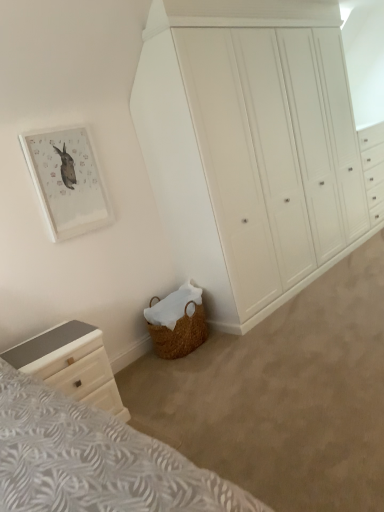
Question: From the image's perspective, is white glossy chest of drawers at lower left, the 2th chest of drawers from the right, positioned above or below matte white picture frame at upper left?

Choices:
 (A) above
 (B) below

Answer: (B)

Question: Considering their positions, is white glossy chest of drawers at lower left, arranged as the 2th chest of drawers when viewed from the back, located in front of or behind matte white picture frame at upper left?

Choices:
 (A) front
 (B) behind

Answer: (A)

Question: Which is farther from the matte white picture frame at upper left?

Choices:
 (A) white painted wood wardrobe at center, which ranks as the 2th chest of drawers in bottom-to-top order
 (B) white glossy chest of drawers at lower left, arranged as the 2th chest of drawers when viewed from the back

Answer: (A)

Question: Which object is positioned closest to the white painted wood wardrobe at center, which appears as the 1th chest of drawers when viewed from the back?

Choices:
 (A) white glossy chest of drawers at lower left, the 2th chest of drawers from the right
 (B) matte white picture frame at upper left

Answer: (B)